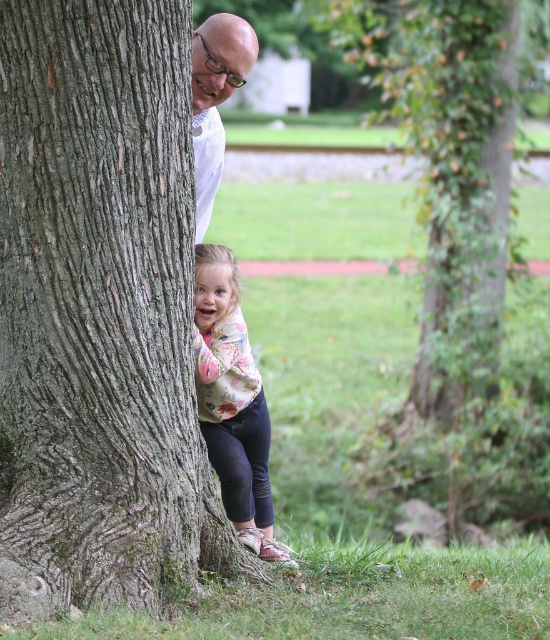
You are standing in the outdoor scene described. You need to find the smooth brown tree trunk at left. Based on its coordinates, where should you look to locate it?

The smooth brown tree trunk at left is located at coordinates point (100, 312), so you should look towards the left side of the image near those coordinates to find it.

In the scene shown: You are a photographer trying to capture a candid shot of the two people behind the tree. You need to ensure that both the smooth brown tree trunk at left and the floral sweater at lower center are fully visible in the frame. Given the distance between them, what is the minimum width of your camera lens in inches to capture both subjects without cropping?

The distance between the smooth brown tree trunk at left and the floral sweater at lower center is 24.34 inches. To capture both subjects without cropping, the camera lens must be at least 24.34 inches wide.